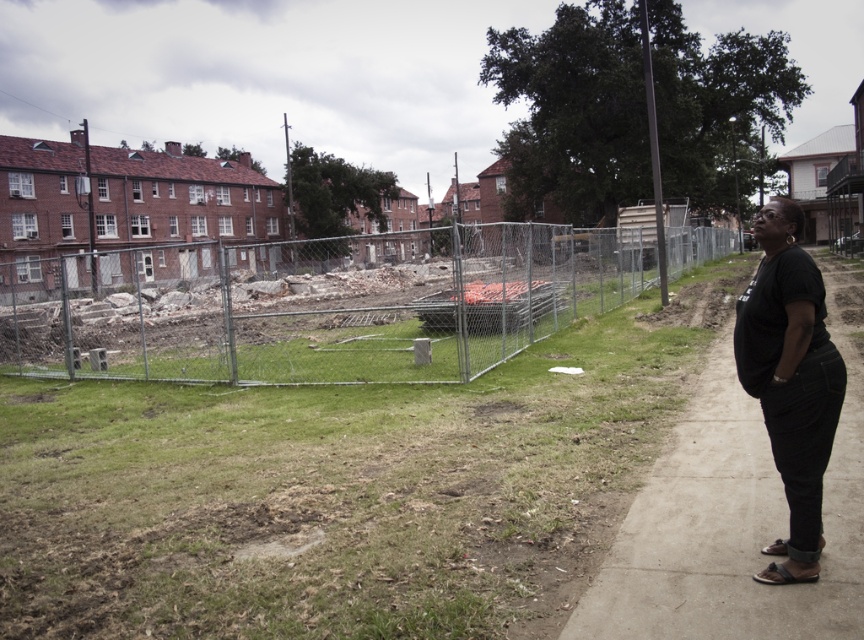
You are standing on the concrete sidewalk at right. If you want to reach the construction site enclosed by the chain link fence, which direction should you walk to get closer to it?

The concrete sidewalk at right is located at point (735,513). To reach the construction site enclosed by the chain link fence, you should walk towards the left since the construction site is on the opposite side of the sidewalk from where you are standing.

You are a delivery person trying to navigate through the sidewalk. The concrete sidewalk at right and the black cotton shirt at right are both on your path. Which one of these two objects occupies more horizontal space from left to right?

The concrete sidewalk at right is wider than the black cotton shirt at right, so the sidewalk occupies more horizontal space from left to right.

Consider the image. You are a delivery person trying to reach the construction site fence. You see the concrete sidewalk at right and the black cotton shirt at right. Which object is closer to the ground?

The concrete sidewalk at right is closer to the ground because it is below the black cotton shirt at right.